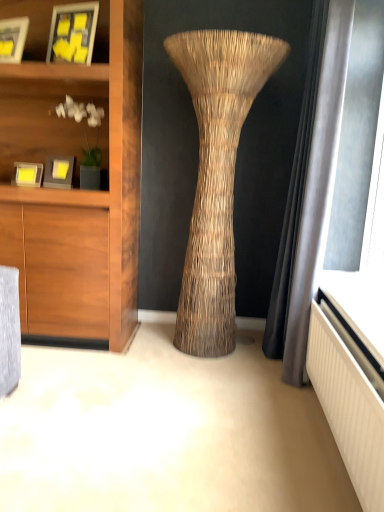
Question: Is matte gray shelf at upper left taller or shorter than matte yellow picture frame at left, the fourth picture frame positioned from the top?

Choices:
 (A) short
 (B) tall

Answer: (B)

Question: From a real-world perspective, is matte gray shelf at upper left above or below matte yellow picture frame at left, arranged as the 1th picture frame when ordered from the bottom?

Choices:
 (A) below
 (B) above

Answer: (B)

Question: Which is farther from the matte yellow picture frame at left, arranged as the 1th picture frame when ordered from the bottom?

Choices:
 (A) matte gray shelf at upper left
 (B) natural woven vase at center
 (C) matte black picture frame at upper left, the third picture frame positioned from the bottom
 (D) matte yellow paper at upper left, the first picture frame viewed from the top
 (E) matte gray picture frame at left, arranged as the 3th picture frame when viewed from the top

Answer: (B)

Question: Which object is positioned closest to the matte gray shelf at upper left?

Choices:
 (A) matte yellow paper at upper left, the fourth picture frame in the bottom-to-top sequence
 (B) matte black picture frame at upper left, the third picture frame positioned from the bottom
 (C) matte yellow picture frame at left, the fourth picture frame positioned from the top
 (D) matte gray picture frame at left, which is the second picture frame in bottom-to-top order
 (E) natural woven vase at center

Answer: (D)